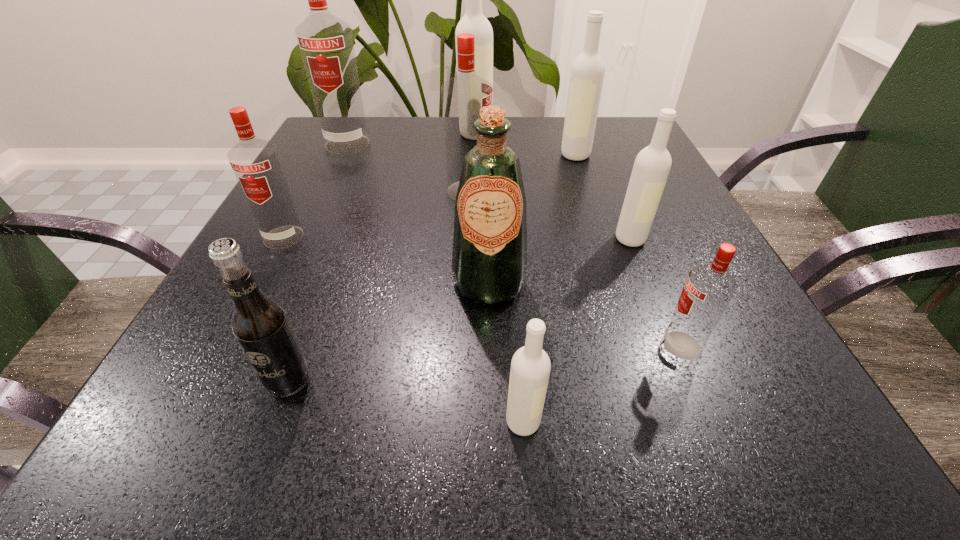
Locate an element on the screen. This screenshot has height=540, width=960. the leftmost white vodka is located at coordinates (474, 22).

Where is `the biggest white vodka`? the biggest white vodka is located at coordinates (474, 22).

I want to click on the biggest red vodka, so click(x=325, y=41).

This screenshot has height=540, width=960. In order to click on the third nearest red vodka in this screenshot , I will do `click(462, 96)`.

At what (x,y) coordinates should I click in order to perform the action: click on the third red vodka from left to right. Please return your answer as a coordinate pair (x, y). Image resolution: width=960 pixels, height=540 pixels. Looking at the image, I should click on (462, 96).

You are a GUI agent. You are given a task and a screenshot of the screen. Output one action in this format:
    pyautogui.click(x=<x>, y=<y>)
    Task: Click on the second biggest white vodka
    This screenshot has width=960, height=540.
    Given the screenshot: What is the action you would take?
    pyautogui.click(x=587, y=72)

This screenshot has height=540, width=960. I want to click on green olive oil, so click(x=489, y=261).

You are a GUI agent. You are given a task and a screenshot of the screen. Output one action in this format:
    pyautogui.click(x=<x>, y=<y>)
    Task: Click on the seventh farthest object
    
    Given the screenshot: What is the action you would take?
    (x=489, y=261)

You are a GUI agent. You are given a task and a screenshot of the screen. Output one action in this format:
    pyautogui.click(x=<x>, y=<y>)
    Task: Click on the second nearest white vodka
    
    Given the screenshot: What is the action you would take?
    pyautogui.click(x=651, y=168)

Find the location of a particular element. The image size is (960, 540). the second nearest red vodka is located at coordinates (256, 163).